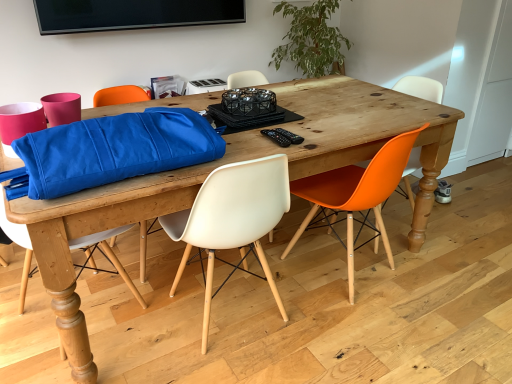
The image size is (512, 384). In order to click on free space to the left of black plastic remote control at center, acting as the second remote control starting from the left in this screenshot , I will do `click(243, 137)`.